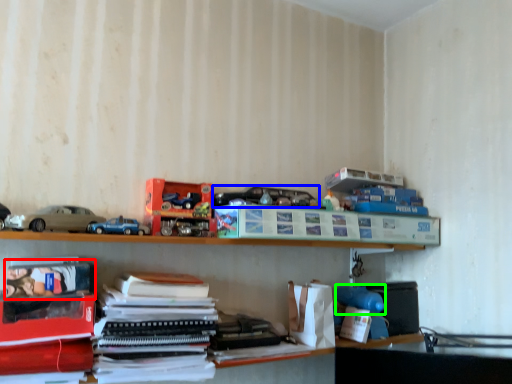
Question: Which object is positioned closest to book (highlighted by a red box)? Select from toy (highlighted by a blue box) and toy (highlighted by a green box).

Choices:
 (A) toy
 (B) toy

Answer: (A)